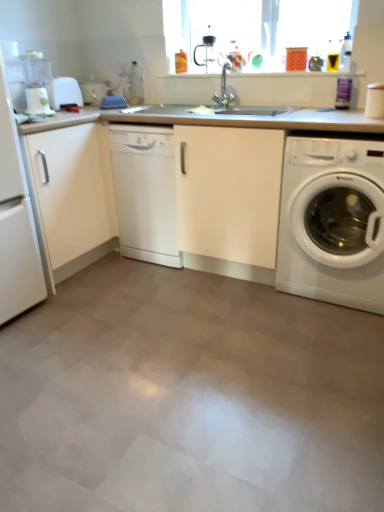
Question: From the image's perspective, relative to white glossy dishwasher at center, is white plastic toaster at left, marked as the second appliance in a back-to-front arrangement, above or below?

Choices:
 (A) below
 (B) above

Answer: (B)

Question: Based on their sizes in the image, would you say white plastic toaster at left, marked as the first appliance in a front-to-back arrangement, is bigger or smaller than white glossy dishwasher at center?

Choices:
 (A) small
 (B) big

Answer: (A)

Question: Which of these objects is positioned farthest from the transparent glass window screen at upper center?

Choices:
 (A) matte white toaster at upper left, the first appliance positioned from the back
 (B) white plastic coffee machine at left
 (C) white glossy dishwasher at center
 (D) white matte countertop at center
 (E) white matte refrigerator at left

Answer: (E)

Question: Which is farther from the white matte cabinet at left?

Choices:
 (A) white glossy washing machine at lower right
 (B) white matte countertop at center
 (C) matte white toaster at upper left, placed as the second appliance when sorted from front to back
 (D) transparent glass window screen at upper center
 (E) white plastic toaster at left, marked as the first appliance in a front-to-back arrangement

Answer: (A)